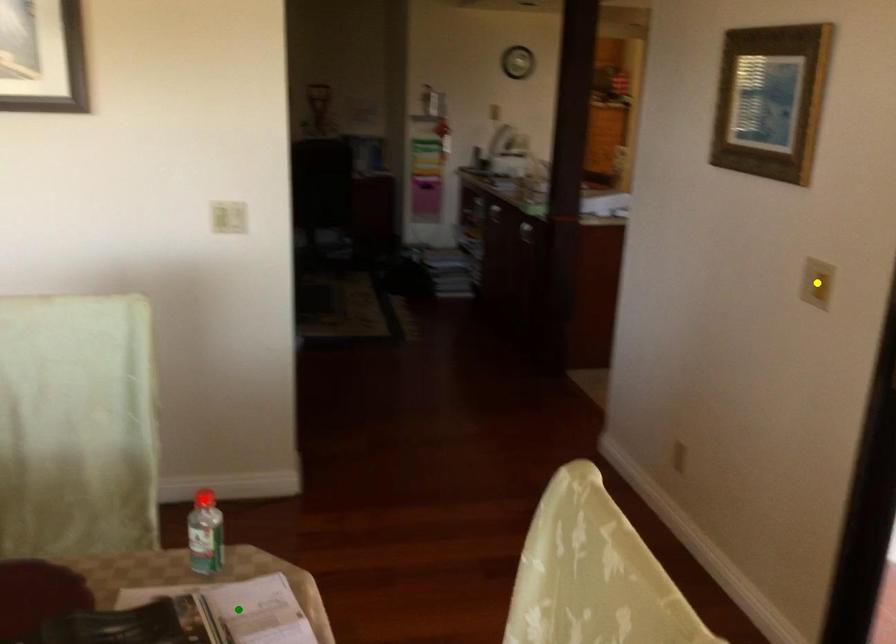
Order these from nearest to farthest:
yellow point, red point, green point

green point
yellow point
red point